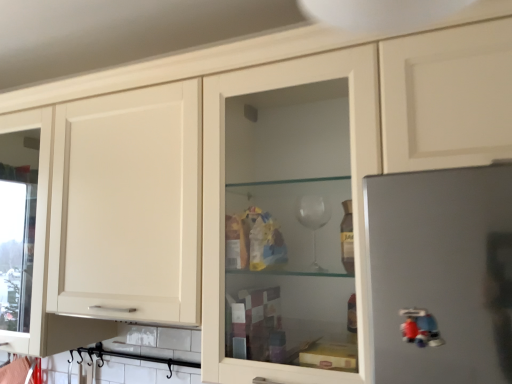
This screenshot has height=384, width=512. Describe the element at coordinates (420, 328) in the screenshot. I see `plastic matte toy at lower right` at that location.

You are a GUI agent. You are given a task and a screenshot of the screen. Output one action in this format:
    pyautogui.click(x=<x>, y=<y>)
    Task: Click on the plastic matte toy at lower right
    This screenshot has height=384, width=512.
    Given the screenshot: What is the action you would take?
    pyautogui.click(x=420, y=328)

In order to face plastic matte toy at lower right, should I rotate leftwards or rightwards?

Rotate your view right by about 21.412°.

At what (x,y) coordinates should I click in order to perform the action: click on plastic matte toy at lower right. Please return your answer as a coordinate pair (x, y). This screenshot has width=512, height=384. Looking at the image, I should click on (420, 328).